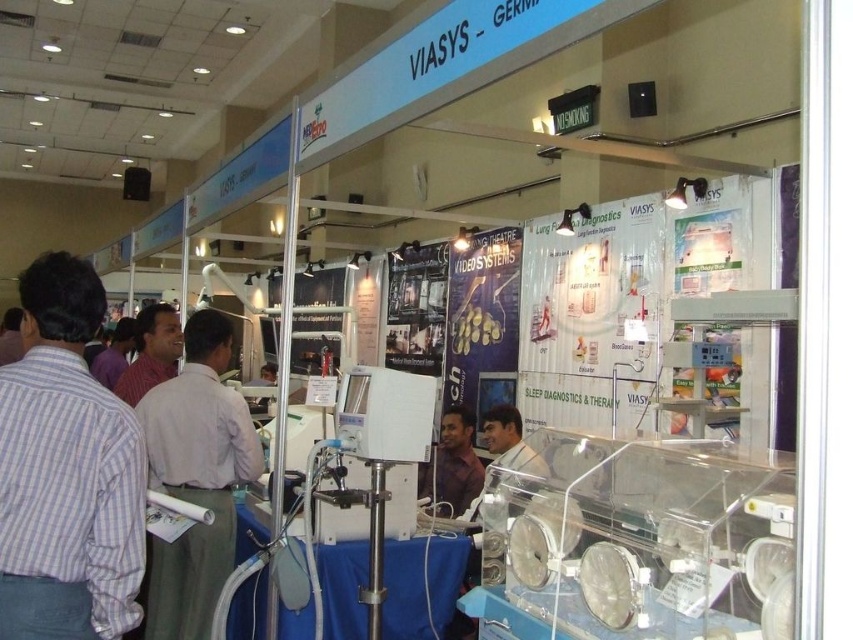
Question: Which is nearer to the light brown shirt at center?

Choices:
 (A) matte brown shirt at center
 (B) striped cotton shirt at left
 (C) matte pink shirt at left

Answer: (C)

Question: Does striped cotton shirt at left appear under matte brown shirt at center?

Choices:
 (A) no
 (B) yes

Answer: (A)

Question: Among these objects, which one is farthest from the camera?

Choices:
 (A) striped cotton shirt at left
 (B) matte pink shirt at left

Answer: (B)

Question: Is matte brown shirt at center to the right of matte pink shirt at left from the viewer's perspective?

Choices:
 (A) yes
 (B) no

Answer: (A)

Question: Among these points, which one is nearest to the camera?

Choices:
 (A) (79, 323)
 (B) (163, 301)
 (C) (221, 531)
 (D) (463, 408)

Answer: (A)

Question: Does light brown shirt at center have a smaller size compared to matte pink shirt at left?

Choices:
 (A) no
 (B) yes

Answer: (A)